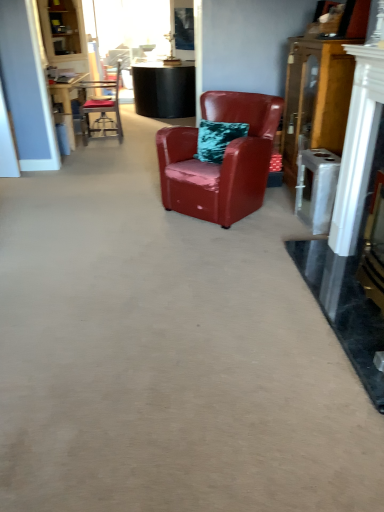
Measure the distance between point (320, 83) and camera.

Point (320, 83) and camera are 9.59 feet apart.

What do you see at coordinates (103, 106) in the screenshot? I see `metallic silver chair at upper left, which is the second chair in right-to-left order` at bounding box center [103, 106].

What are the coordinates of `glossy leather armchair at center, positioned as the first chair in front-to-back order` in the screenshot? It's located at (222, 162).

This screenshot has height=512, width=384. What do you see at coordinates (222, 162) in the screenshot? I see `glossy leather armchair at center, which is the 1th chair in bottom-to-top order` at bounding box center [222, 162].

Image resolution: width=384 pixels, height=512 pixels. What are the coordinates of `wooden cabinet at right` in the screenshot? It's located at (315, 98).

Are metallic silver chair at upper left, which appears as the first chair when viewed from the left, and wooden cabinet at right making contact?

No, metallic silver chair at upper left, which appears as the first chair when viewed from the left, is not next to wooden cabinet at right.

Considering the positions of point (118, 83) and point (299, 124), is point (118, 83) closer or farther from the camera than point (299, 124)?

Point (118, 83) appears to be farther away from the viewer than point (299, 124).

Can you tell me how much metallic silver chair at upper left, which is the second chair in right-to-left order, and wooden cabinet at right differ in facing direction?

There is a 5.28-degree angle between the facing directions of metallic silver chair at upper left, which is the second chair in right-to-left order, and wooden cabinet at right.

Who is bigger, metallic silver chair at upper left, the 1th chair from the top, or wooden cabinet at right?

Bigger between the two is wooden cabinet at right.

Is metallic silver chair at upper left, which is the second chair from front to back, bigger than glossy leather armchair at center, which is the first chair in right-to-left order?

Incorrect, metallic silver chair at upper left, which is the second chair from front to back, is not larger than glossy leather armchair at center, which is the first chair in right-to-left order.

Is metallic silver chair at upper left, which appears as the first chair when viewed from the left, oriented towards glossy leather armchair at center, the 2th chair when ordered from left to right?

No.

Can you confirm if metallic silver chair at upper left, acting as the second chair starting from the bottom, is shorter than glossy leather armchair at center, the 2th chair when ordered from left to right?

In fact, metallic silver chair at upper left, acting as the second chair starting from the bottom, may be taller than glossy leather armchair at center, the 2th chair when ordered from left to right.

From a real-world perspective, is metallic silver chair at upper left, the 1th chair from the top, physically above glossy leather armchair at center, which is the first chair in right-to-left order?

Indeed, from a real-world perspective, metallic silver chair at upper left, the 1th chair from the top, stands above glossy leather armchair at center, which is the first chair in right-to-left order.

Does glossy leather armchair at center, marked as the 2th chair in a top-to-bottom arrangement, come in front of metallic silver chair at upper left, which is the second chair in right-to-left order?

Yes, it is.

Can you confirm if glossy leather armchair at center, which appears as the 2th chair when viewed from the back, is bigger than metallic silver chair at upper left, which is the second chair in right-to-left order?

Yes.

From a real-world perspective, is glossy leather armchair at center, which is the first chair in right-to-left order, located higher than metallic silver chair at upper left, which is the second chair in right-to-left order?

Incorrect, from a real-world perspective, glossy leather armchair at center, which is the first chair in right-to-left order, is lower than metallic silver chair at upper left, which is the second chair in right-to-left order.

Is glossy leather armchair at center, positioned as the first chair in front-to-back order, next to metallic silver chair at upper left, which is the second chair from front to back?

No, glossy leather armchair at center, positioned as the first chair in front-to-back order, is not next to metallic silver chair at upper left, which is the second chair from front to back.

Is point (276, 127) farther from viewer compared to point (286, 150)?

No, (276, 127) is closer to viewer.

In the scene shown: From the image's perspective, is glossy leather armchair at center, which appears as the 2th chair when viewed from the back, below wooden cabinet at right?

Indeed, from the image's perspective, glossy leather armchair at center, which appears as the 2th chair when viewed from the back, is shown beneath wooden cabinet at right.

Can you see glossy leather armchair at center, which appears as the 2th chair when viewed from the back, touching wooden cabinet at right?

glossy leather armchair at center, which appears as the 2th chair when viewed from the back, and wooden cabinet at right are not in contact.

Locate an element on the screen. dresser below the metallic silver chair at upper left, acting as the second chair starting from the bottom (from the image's perspective) is located at coordinates (315, 98).

Based on the photo, from the image's perspective, is wooden cabinet at right above or below metallic silver chair at upper left, which appears as the first chair when viewed from the left?

wooden cabinet at right is below metallic silver chair at upper left, which appears as the first chair when viewed from the left.

Could you measure the distance between wooden cabinet at right and metallic silver chair at upper left, which appears as the first chair when viewed from the left?

wooden cabinet at right is 2.87 meters from metallic silver chair at upper left, which appears as the first chair when viewed from the left.

Which point is more distant from viewer, (289, 111) or (97, 86)?

Positioned behind is point (97, 86).

Is wooden cabinet at right bigger than glossy leather armchair at center, which is the first chair in right-to-left order?

Actually, wooden cabinet at right might be smaller than glossy leather armchair at center, which is the first chair in right-to-left order.

How distant is wooden cabinet at right from glossy leather armchair at center, marked as the 2th chair in a top-to-bottom arrangement?

They are 24.32 inches apart.

Which of these two, wooden cabinet at right or glossy leather armchair at center, which is the 1th chair in bottom-to-top order, is wider?

Wider between the two is glossy leather armchair at center, which is the 1th chair in bottom-to-top order.

Identify the location of chair that is above the wooden cabinet at right (from the image's perspective). This screenshot has width=384, height=512. (103, 106).

The image size is (384, 512). I want to click on chair on the left of glossy leather armchair at center, marked as the 2th chair in a top-to-bottom arrangement, so click(x=103, y=106).

Estimate the real-world distances between objects in this image. Which object is further from wooden cabinet at right, glossy leather armchair at center, the 2th chair when ordered from left to right, or metallic silver chair at upper left, which is the first chair from back to front?

metallic silver chair at upper left, which is the first chair from back to front, lies further to wooden cabinet at right than the other object.

When comparing their distances from glossy leather armchair at center, positioned as the first chair in front-to-back order, does metallic silver chair at upper left, which is the first chair from back to front, or wooden cabinet at right seem further?

Among the two, metallic silver chair at upper left, which is the first chair from back to front, is located further to glossy leather armchair at center, positioned as the first chair in front-to-back order.

When comparing their distances from wooden cabinet at right, does metallic silver chair at upper left, acting as the second chair starting from the bottom, or glossy leather armchair at center, which appears as the 2th chair when viewed from the back, seem closer?

Based on the image, glossy leather armchair at center, which appears as the 2th chair when viewed from the back, appears to be nearer to wooden cabinet at right.

Considering their positions, is wooden cabinet at right positioned further to glossy leather armchair at center, positioned as the first chair in front-to-back order, than metallic silver chair at upper left, acting as the second chair starting from the bottom?

metallic silver chair at upper left, acting as the second chair starting from the bottom, is further to glossy leather armchair at center, positioned as the first chair in front-to-back order.

Based on their spatial positions, is wooden cabinet at right or glossy leather armchair at center, which is the first chair in right-to-left order, further from metallic silver chair at upper left, which is the second chair in right-to-left order?

wooden cabinet at right is further to metallic silver chair at upper left, which is the second chair in right-to-left order.

Considering their positions, is glossy leather armchair at center, positioned as the first chair in front-to-back order, positioned further to metallic silver chair at upper left, which is the second chair in right-to-left order, than wooden cabinet at right?

wooden cabinet at right lies further to metallic silver chair at upper left, which is the second chair in right-to-left order, than the other object.

Identify the location of dresser located between glossy leather armchair at center, marked as the 2th chair in a top-to-bottom arrangement, and metallic silver chair at upper left, acting as the second chair starting from the bottom, in the depth direction. (315, 98).